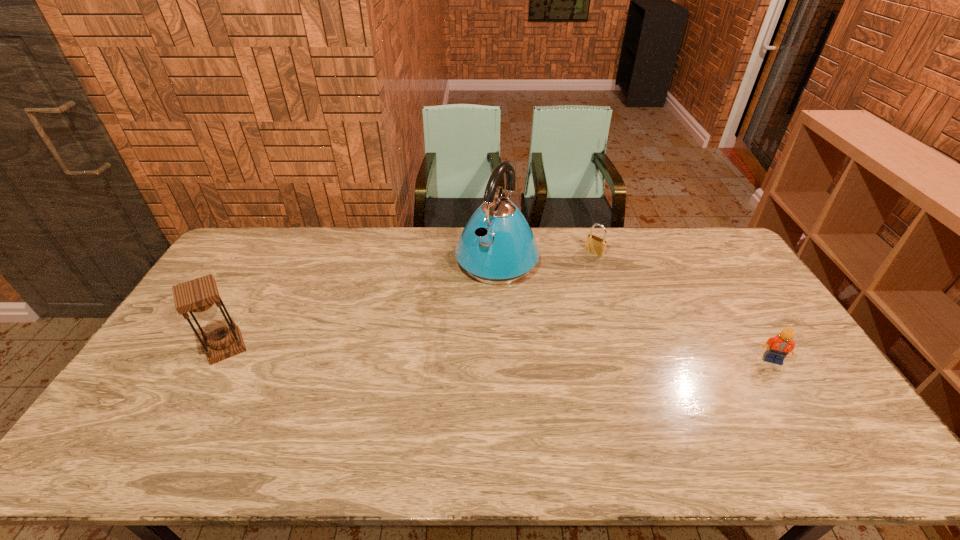
Image resolution: width=960 pixels, height=540 pixels. Identify the location of free space on the desktop that is between the hourglass and the Lego and is positioned on the front-facing side of the padlock. (475, 353).

Find the location of a particular element. This screenshot has width=960, height=540. free spot on the desktop that is between the hourglass and the rightmost object and is positioned at the spout of the tallest object is located at coordinates (432, 352).